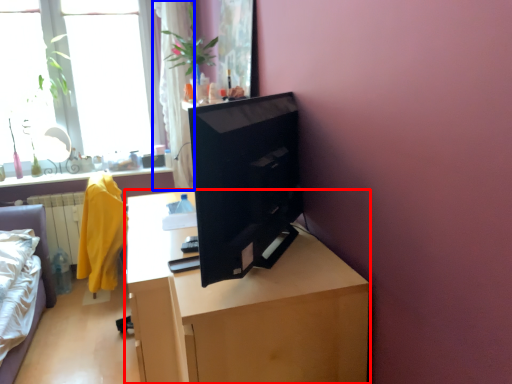
Question: Which object is further to the camera taking this photo, desk (highlighted by a red box) or curtain (highlighted by a blue box)?

Choices:
 (A) desk
 (B) curtain

Answer: (B)